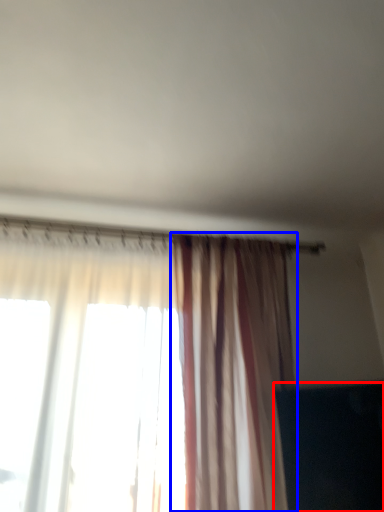
Question: Which object is further to the camera taking this photo, dark (highlighted by a red box) or curtain (highlighted by a blue box)?

Choices:
 (A) dark
 (B) curtain

Answer: (A)